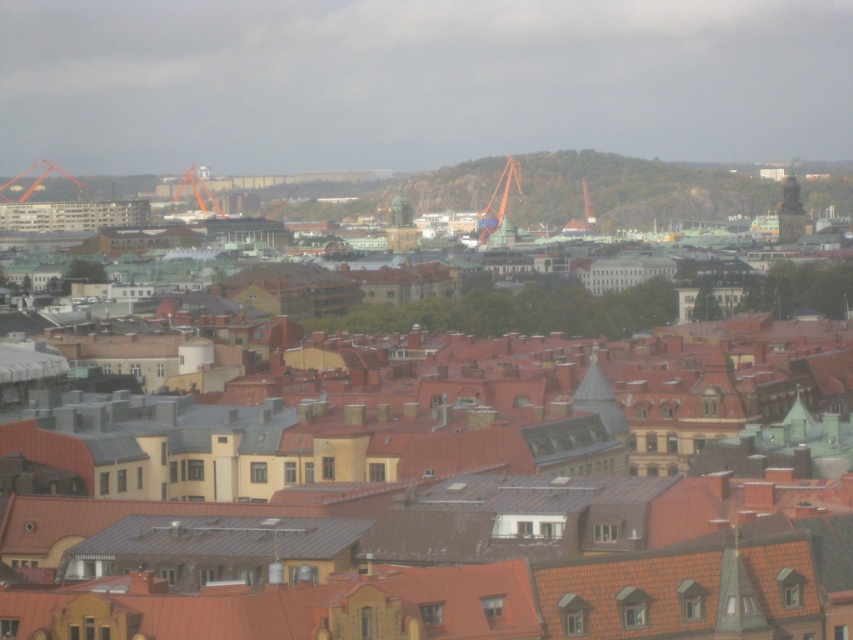
Does green metallic crane at center appear on the right side of orange metallic crane at upper left?

Yes, green metallic crane at center is to the right of orange metallic crane at upper left.

Can you confirm if green metallic crane at center is shorter than orange metallic crane at upper left?

No, green metallic crane at center is not shorter than orange metallic crane at upper left.

Looking at this image, who is more distant from viewer, (482, 243) or (45, 161)?

Point (45, 161)

Find the location of `green metallic crane at center`. green metallic crane at center is located at coordinates (498, 200).

Who is higher up, green metallic crane at center or bronze statue at center?

green metallic crane at center

Is point (486, 216) positioned in front of point (387, 225)?

That is False.

Find the location of a particular element. This screenshot has height=640, width=853. green metallic crane at center is located at coordinates (498, 200).

Locate an element on the screen. The width and height of the screenshot is (853, 640). green metallic crane at center is located at coordinates (498, 200).

Who is more forward, (798,230) or (196,189)?

Point (798,230) is in front.

Is point (799, 208) closer to viewer compared to point (178, 188)?

Yes, it is in front of point (178, 188).

The width and height of the screenshot is (853, 640). Identify the location of matte black tower at upper right. (791, 212).